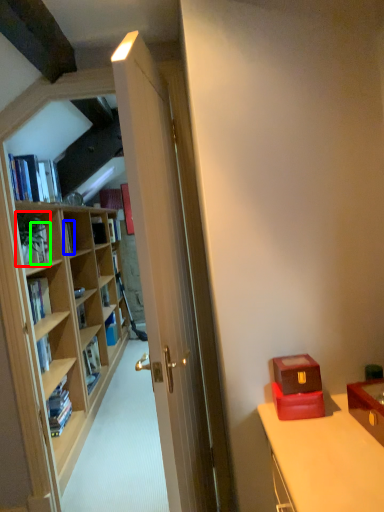
Question: Estimate the real-world distances between objects in this image. Which object is farther from houseplant (highlighted by a red box), book (highlighted by a blue box) or book (highlighted by a green box)?

Choices:
 (A) book
 (B) book

Answer: (A)